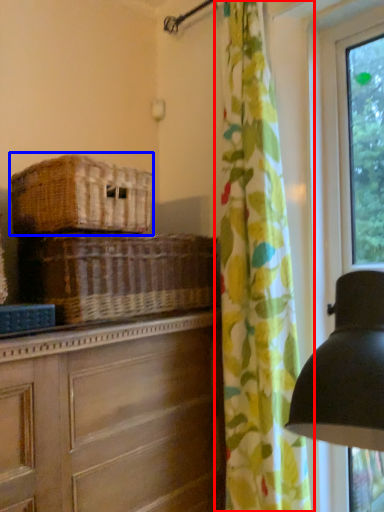
Question: Which point is closer to the camera, curtain (highlighted by a red box) or basket (highlighted by a blue box)?

Choices:
 (A) curtain
 (B) basket

Answer: (B)